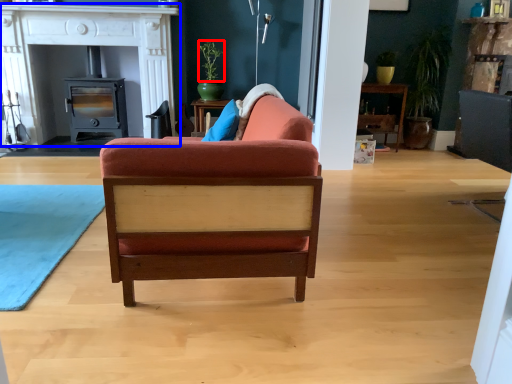
Question: Which object is closer to the camera taking this photo, plant (highlighted by a red box) or fireplace (highlighted by a blue box)?

Choices:
 (A) plant
 (B) fireplace

Answer: (B)